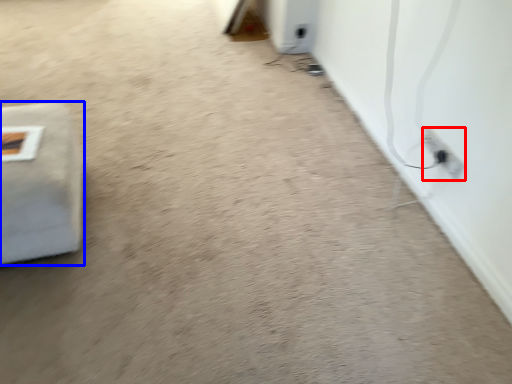
Question: Among these objects, which one is nearest to the camera, electric outlet (highlighted by a red box) or furniture (highlighted by a blue box)?

Choices:
 (A) electric outlet
 (B) furniture

Answer: (B)